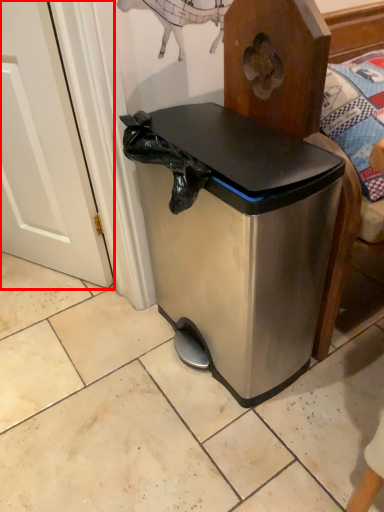
Question: From the image's perspective, what is the correct spatial positioning of screen door (annotated by the red box) in reference to waste container?

Choices:
 (A) below
 (B) above

Answer: (B)